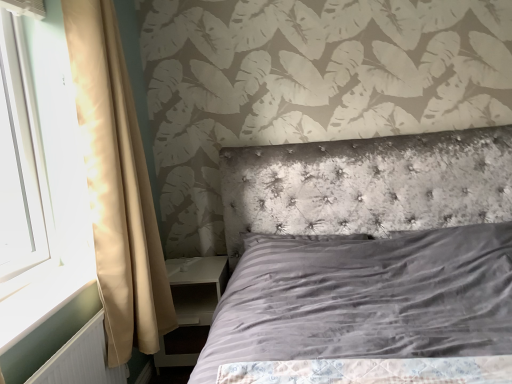
Question: Does beige satin curtain at left lie in front of white plastic radiator at lower left?

Choices:
 (A) no
 (B) yes

Answer: (A)

Question: From the image's perspective, is beige satin curtain at left beneath white plastic radiator at lower left?

Choices:
 (A) no
 (B) yes

Answer: (A)

Question: From a real-world perspective, is beige satin curtain at left below white plastic radiator at lower left?

Choices:
 (A) yes
 (B) no

Answer: (B)

Question: From a real-world perspective, is beige satin curtain at left positioned over white plastic radiator at lower left based on gravity?

Choices:
 (A) no
 (B) yes

Answer: (B)

Question: Is beige satin curtain at left not inside white plastic radiator at lower left?

Choices:
 (A) no
 (B) yes

Answer: (B)

Question: From a real-world perspective, is white plastic radiator at lower left physically located above or below white glossy wood at left?

Choices:
 (A) below
 (B) above

Answer: (A)

Question: Is white plastic radiator at lower left situated inside white glossy wood at left or outside?

Choices:
 (A) inside
 (B) outside

Answer: (B)

Question: In terms of size, does white plastic radiator at lower left appear bigger or smaller than white glossy wood at left?

Choices:
 (A) small
 (B) big

Answer: (B)

Question: From the image's perspective, is white plastic radiator at lower left located above or below white glossy wood at left?

Choices:
 (A) above
 (B) below

Answer: (B)

Question: From a real-world perspective, is white plastic window screen at left above or below white plastic radiator at lower left?

Choices:
 (A) below
 (B) above

Answer: (B)

Question: Choose the correct answer: Is white plastic window screen at left inside white plastic radiator at lower left or outside it?

Choices:
 (A) inside
 (B) outside

Answer: (B)

Question: In the image, is white plastic window screen at left positioned in front of or behind white plastic radiator at lower left?

Choices:
 (A) front
 (B) behind

Answer: (B)

Question: Is white plastic window screen at left wider or thinner than white plastic radiator at lower left?

Choices:
 (A) wide
 (B) thin

Answer: (A)

Question: Would you say velvet tufted headboard at center is inside or outside white glossy wood at left?

Choices:
 (A) outside
 (B) inside

Answer: (A)

Question: Is point (361, 314) closer or farther from the camera than point (7, 334)?

Choices:
 (A) farther
 (B) closer

Answer: (A)